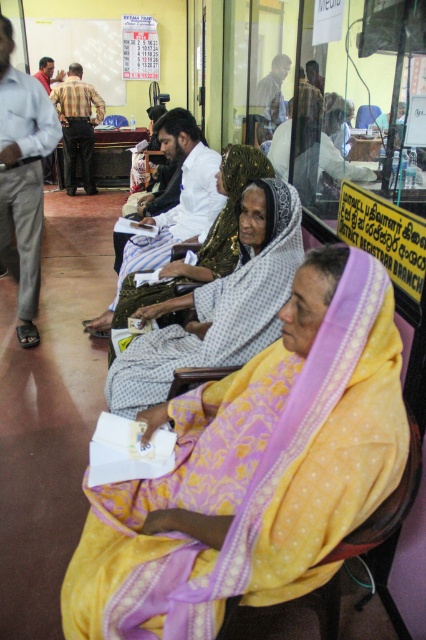
Question: Can you confirm if yellow printed saree at center is positioned to the left of red shirt at center?

Choices:
 (A) no
 (B) yes

Answer: (A)

Question: Does white striped shirt at center come behind plaid shirt at center?

Choices:
 (A) no
 (B) yes

Answer: (A)

Question: Which of the following is the closest to the observer?

Choices:
 (A) (60, 116)
 (B) (253, 577)

Answer: (B)

Question: Which point is farther to the camera?

Choices:
 (A) white striped shirt at center
 (B) gray cotton shirt at left
 (C) light brown wooden chair at upper center
 (D) yellow printed saree at center

Answer: (C)

Question: Does white striped shirt at center have a greater width compared to light brown wooden chair at upper center?

Choices:
 (A) yes
 (B) no

Answer: (A)

Question: Which of the following is the farthest from the observer?

Choices:
 (A) (172, 230)
 (B) (69, 90)

Answer: (B)